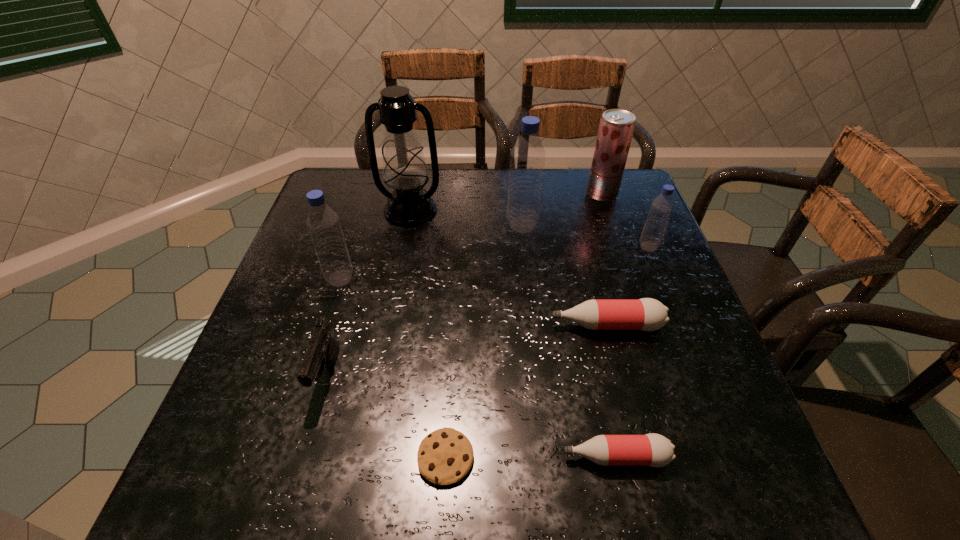
Locate an element on the screen. the third object from left to right is located at coordinates pyautogui.click(x=404, y=168).

This screenshot has width=960, height=540. I want to click on black oil lamp, so click(404, 168).

Locate an element on the screen. the farthest bottle is located at coordinates (527, 158).

You are a GUI agent. You are given a task and a screenshot of the screen. Output one action in this format:
    pyautogui.click(x=<x>, y=<y>)
    Task: Click on the biggest blue bottle
    
    Given the screenshot: What is the action you would take?
    pyautogui.click(x=527, y=158)

Find the location of a particular element. The width and height of the screenshot is (960, 540). strawberry fruit juice is located at coordinates (616, 128).

At what (x,y) coordinates should I click in order to perform the action: click on the nearest blue bottle. Please return your answer as a coordinate pair (x, y). The height and width of the screenshot is (540, 960). Looking at the image, I should click on (323, 223).

Where is `the leftmost bottle`? The height and width of the screenshot is (540, 960). the leftmost bottle is located at coordinates (323, 223).

Image resolution: width=960 pixels, height=540 pixels. Find the location of `the rightmost bottle`. the rightmost bottle is located at coordinates (662, 206).

This screenshot has height=540, width=960. I want to click on the rightmost blue bottle, so click(662, 206).

Identify the location of the fourth shortest object. The width and height of the screenshot is (960, 540). (323, 350).